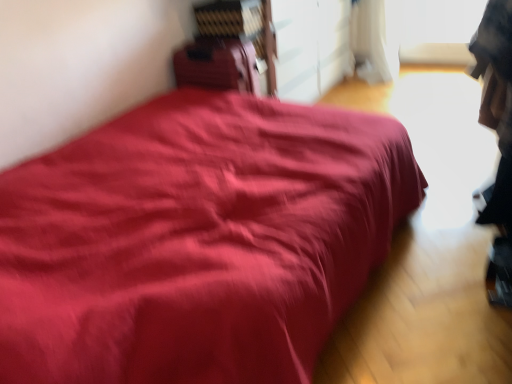
Question: Is matte red bed at center inside or outside of matte red suitcase at center?

Choices:
 (A) inside
 (B) outside

Answer: (B)

Question: From the image's perspective, is matte red bed at center located above or below matte red suitcase at center?

Choices:
 (A) below
 (B) above

Answer: (A)

Question: Considering their positions, is matte red bed at center located in front of or behind matte red suitcase at center?

Choices:
 (A) front
 (B) behind

Answer: (A)

Question: Is matte red suitcase at center inside or outside of matte red bed at center?

Choices:
 (A) inside
 (B) outside

Answer: (B)

Question: Looking at their shapes, would you say matte red suitcase at center is wider or thinner than matte red bed at center?

Choices:
 (A) wide
 (B) thin

Answer: (B)

Question: Is matte red suitcase at center to the left or to the right of matte red bed at center in the image?

Choices:
 (A) right
 (B) left

Answer: (B)

Question: From the image's perspective, is matte red suitcase at center positioned above or below matte red bed at center?

Choices:
 (A) below
 (B) above

Answer: (B)